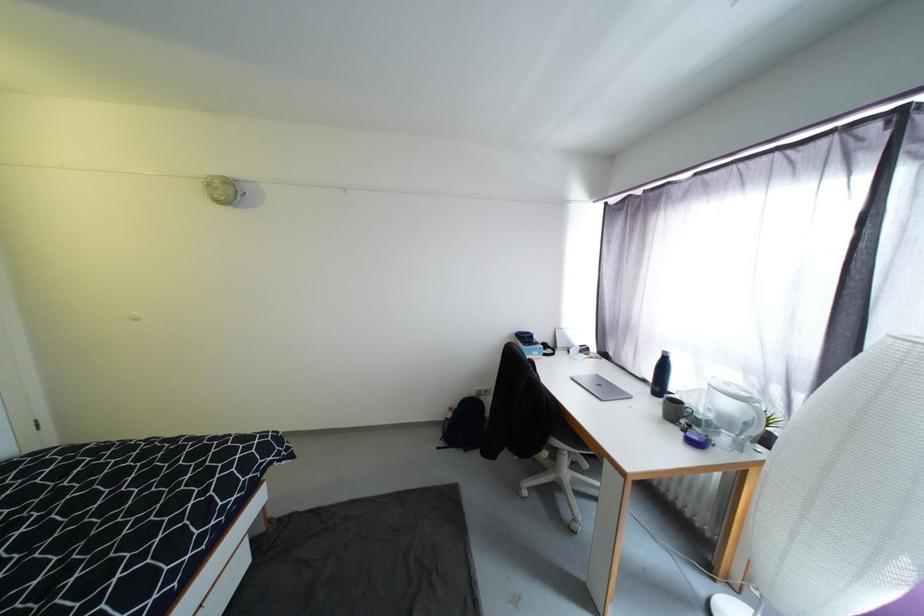
The location [465,424] corresponds to which object?

It refers to a black backpack.